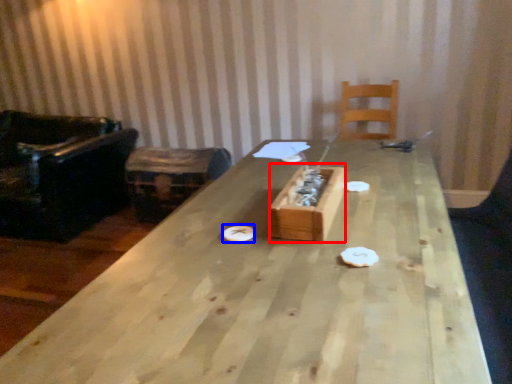
Question: Which of the following is the farthest to the observer, cardboard box (highlighted by a red box) or paper plate (highlighted by a blue box)?

Choices:
 (A) cardboard box
 (B) paper plate

Answer: (B)